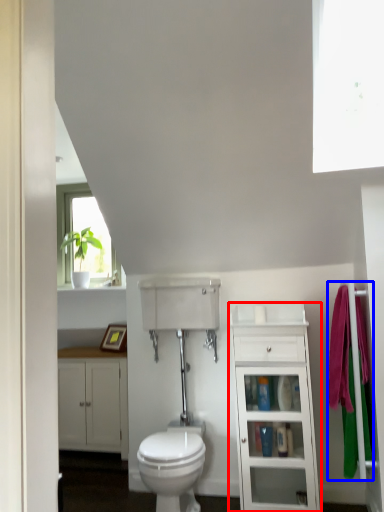
Question: Which object is closer to the camera taking this photo, bathroom cabinet (highlighted by a red box) or bath towel (highlighted by a blue box)?

Choices:
 (A) bathroom cabinet
 (B) bath towel

Answer: (B)